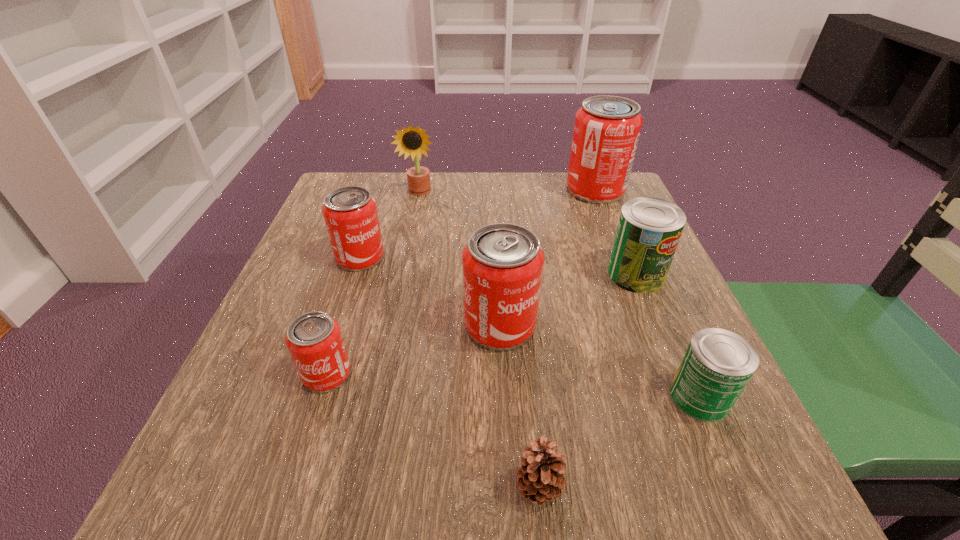
Locate an element on the screen. This screenshot has height=540, width=960. free point between the pinecone and the fourth nearest object is located at coordinates (520, 407).

Identify the location of free space between the farthest can and the nearest red can. (461, 282).

Identify the location of free point between the sunflower and the nearest red can. The height and width of the screenshot is (540, 960). [x=373, y=284].

Locate an element on the screen. vacant area that lies between the third biggest red can and the rightmost red can is located at coordinates (478, 224).

Identify the location of vacant area that lies between the sunflower and the nearer green can. This screenshot has height=540, width=960. (560, 294).

At what (x,y) coordinates should I click in order to perform the action: click on object that can be found as the third closest to the nearest object. Please return your answer as a coordinate pair (x, y). Looking at the image, I should click on (314, 340).

Select which object appears as the third closest to the nearer green can. Please provide its 2D coordinates. Your answer should be formatted as a tuple, i.e. [(x, y)], where the tuple contains the x and y coordinates of a point satisfying the conditions above.

[(502, 263)]

This screenshot has height=540, width=960. Identify the location of the fourth closest can to the sunflower. (649, 229).

Find the location of a particular element. Image resolution: width=960 pixels, height=540 pixels. the closest can relative to the farther green can is located at coordinates click(x=502, y=263).

Identify the location of red can that stands as the fourth closest to the nearer green can. The image size is (960, 540). (350, 213).